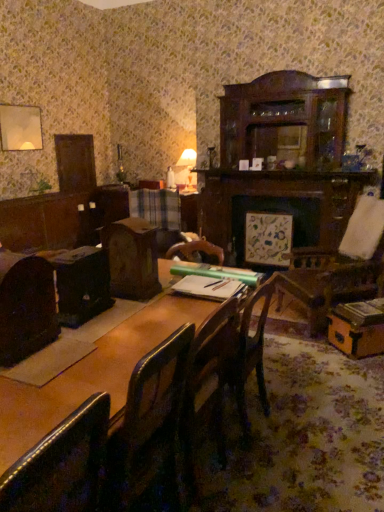
Question: Is dark brown leather chair at left, arranged as the 1th chair when viewed from the back, spatially inside matte white table lamp at upper center, or outside of it?

Choices:
 (A) outside
 (B) inside

Answer: (A)

Question: Is dark brown leather chair at left, which is the 2th chair in front-to-back order, in front of or behind matte white table lamp at upper center in the image?

Choices:
 (A) behind
 (B) front

Answer: (B)

Question: Based on their relative distances, which object is farther from the dark brown leather chair at left, positioned as the 1th chair in top-to-bottom order?

Choices:
 (A) leather at left, the 2th chair positioned from the back
 (B) matte white table lamp at upper center
 (C) wooden table at center

Answer: (B)

Question: Which object is the farthest from the wooden table at center?

Choices:
 (A) dark brown leather chair at left, positioned as the second chair in bottom-to-top order
 (B) leather at left, which is the second chair in top-to-bottom order
 (C) matte white table lamp at upper center

Answer: (C)